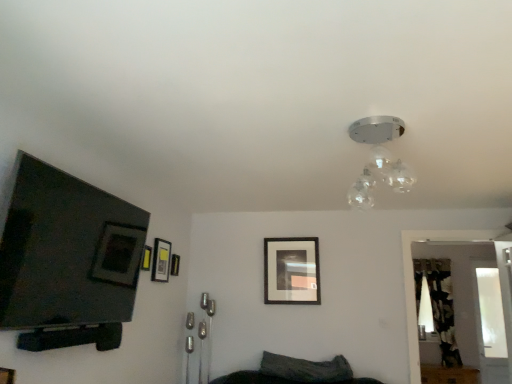
The height and width of the screenshot is (384, 512). What are the coordinates of `matte black picture frame at center, which is the 4th picture frame in left-to-right order` in the screenshot? It's located at coord(291,271).

How much space does matte black picture frame at upper left, which is the 4th picture frame in right-to-left order, occupy horizontally?

The width of matte black picture frame at upper left, which is the 4th picture frame in right-to-left order, is 1.37 inches.

Measure the distance between matte black picture frame at upper left, positioned as the 1th picture frame in front-to-back order, and camera.

They are 10.30 feet apart.

In order to face clear glass light fixture at upper center, should I rotate leftwards or rightwards?

You should look right and rotate roughly 16.570 degrees.

What are the coordinates of `matte black picture frame at upper left, which is counted as the third picture frame, starting from the back` in the screenshot? It's located at (161, 261).

In order to face matte black picture frame at upper left, arranged as the third picture frame when viewed from the front, should I rotate leftwards or rightwards?

Turn left approximately 10.620 degrees to face it.

From the picture: Measure the distance between point (x=174, y=265) and camera.

Point (x=174, y=265) and camera are 12.53 feet apart from each other.

You are a GUI agent. You are given a task and a screenshot of the screen. Output one action in this format:
    pyautogui.click(x=<x>, y=<y>)
    Task: Click on the matte black picture frame at center, which is the 4th picture frame in left-to-right order
    
    Given the screenshot: What is the action you would take?
    pyautogui.click(x=291, y=271)

Is matte black picture frame at center, the 1th picture frame viewed from the right, facing away from transparent glass door at right?

matte black picture frame at center, the 1th picture frame viewed from the right, is not turned away from transparent glass door at right.

How different are the orientations of matte black picture frame at center, the 1th picture frame viewed from the right, and transparent glass door at right in degrees?

The angle between the facing direction of matte black picture frame at center, the 1th picture frame viewed from the right, and the facing direction of transparent glass door at right is 2.74 degrees.

From a real-world perspective, who is located higher, matte black picture frame at center, the 1th picture frame viewed from the right, or transparent glass door at right?

matte black picture frame at center, the 1th picture frame viewed from the right, from a real-world perspective.

Is matte black picture frame at center, the 1th picture frame viewed from the right, taller than transparent glass door at right?

In fact, matte black picture frame at center, the 1th picture frame viewed from the right, may be shorter than transparent glass door at right.

Is clear glass light fixture at upper center positioned far away from transparent glass door at right?

Indeed, clear glass light fixture at upper center is not near transparent glass door at right.

Is clear glass light fixture at upper center wider or thinner than transparent glass door at right?

Considering their sizes, clear glass light fixture at upper center looks broader than transparent glass door at right.

From the image's perspective, is clear glass light fixture at upper center beneath transparent glass door at right?

Actually, clear glass light fixture at upper center appears above transparent glass door at right in the image.

Which object is positioned more to the right, clear glass light fixture at upper center or transparent glass door at right?

Positioned to the right is transparent glass door at right.

Which of these two, transparent glass door at right or dark gray fabric pillow at lower center, is smaller?

With smaller size is dark gray fabric pillow at lower center.

From the image's perspective, would you say transparent glass door at right is shown under dark gray fabric pillow at lower center?

Yes, from the image's perspective, transparent glass door at right is beneath dark gray fabric pillow at lower center.

From a real-world perspective, is transparent glass door at right over dark gray fabric pillow at lower center?

Indeed, from a real-world perspective, transparent glass door at right stands above dark gray fabric pillow at lower center.

Would you say transparent glass door at right is to the left or to the right of dark gray fabric pillow at lower center in the picture?

Based on their positions, transparent glass door at right is located to the right of dark gray fabric pillow at lower center.

Between matte black picture frame at upper left, placed as the third picture frame when sorted from left to right, and dark gray fabric pillow at lower center, which one is positioned behind?

matte black picture frame at upper left, placed as the third picture frame when sorted from left to right, is more distant.

Who is bigger, matte black picture frame at upper left, placed as the third picture frame when sorted from left to right, or dark gray fabric pillow at lower center?

dark gray fabric pillow at lower center.

Is matte black picture frame at upper left, the second picture frame when ordered from back to front, positioned beyond the bounds of dark gray fabric pillow at lower center?

Yes.

From a real-world perspective, between camouflage fabric curtain at right and clear glass light fixture at upper center, who is vertically lower?

camouflage fabric curtain at right is physically lower.

Considering the relative sizes of camouflage fabric curtain at right and clear glass light fixture at upper center in the image provided, is camouflage fabric curtain at right smaller than clear glass light fixture at upper center?

Incorrect, camouflage fabric curtain at right is not smaller in size than clear glass light fixture at upper center.

Is camouflage fabric curtain at right inside or outside of clear glass light fixture at upper center?

camouflage fabric curtain at right is spatially situated outside clear glass light fixture at upper center.

Considering the positions of objects camouflage fabric curtain at right and clear glass light fixture at upper center in the image provided, who is in front, camouflage fabric curtain at right or clear glass light fixture at upper center?

clear glass light fixture at upper center.

Is point (371, 172) positioned in front of point (170, 256)?

Yes, point (371, 172) is closer to viewer.

Does clear glass light fixture at upper center lie in front of matte black picture frame at upper left, the second picture frame when ordered from back to front?

Yes, clear glass light fixture at upper center is closer to the viewer.

Does clear glass light fixture at upper center have a greater width compared to matte black picture frame at upper left, placed as the third picture frame when sorted from left to right?

Yes, clear glass light fixture at upper center is wider than matte black picture frame at upper left, placed as the third picture frame when sorted from left to right.

From the image's perspective, does dark gray fabric pillow at lower center appear higher than transparent glass door at right?

Yes, from the image's perspective, dark gray fabric pillow at lower center is over transparent glass door at right.

From a real-world perspective, which object stands above the other?

From a 3D spatial view, transparent glass door at right is above.

How much distance is there between dark gray fabric pillow at lower center and transparent glass door at right?

dark gray fabric pillow at lower center and transparent glass door at right are 10.25 feet apart from each other.

Find the location of a particular element. window below the matte black picture frame at center, the 1th picture frame viewed from the right (from a real-world perspective) is located at coordinates tap(490, 313).

Locate an element on the screen. This screenshot has height=384, width=512. glass door behind the clear glass light fixture at upper center is located at coordinates (467, 295).

Considering their positions, is matte black picture frame at upper left, the second picture frame when ordered from back to front, positioned further to matte black picture frame at center, the first picture frame positioned from the back, than clear glass light fixture at upper center?

Based on the image, clear glass light fixture at upper center appears to be further to matte black picture frame at center, the first picture frame positioned from the back.

From the image, which object appears to be farther from matte black picture frame at upper left, which is the 4th picture frame in right-to-left order, clear glass light fixture at upper center or matte black picture frame at upper left, placed as the third picture frame when sorted from left to right?

clear glass light fixture at upper center is further to matte black picture frame at upper left, which is the 4th picture frame in right-to-left order.

Estimate the real-world distances between objects in this image. Which object is further from camouflage fabric curtain at right, matte black picture frame at center, the first picture frame positioned from the back, or matte black picture frame at upper left, the fourth picture frame in the back-to-front sequence?

The object further to camouflage fabric curtain at right is matte black picture frame at upper left, the fourth picture frame in the back-to-front sequence.

Looking at the image, which one is located closer to camouflage fabric curtain at right, matte black picture frame at upper left, which ranks as the second picture frame in front-to-back order, or transparent glass door at right?

transparent glass door at right is positioned closer to the anchor camouflage fabric curtain at right.

Which object lies further to the anchor point transparent glass door at right, camouflage fabric curtain at right or matte black picture frame at upper left, positioned as the 1th picture frame in front-to-back order?

matte black picture frame at upper left, positioned as the 1th picture frame in front-to-back order.

Which object lies further to the anchor point matte black picture frame at upper left, which ranks as the second picture frame in front-to-back order, transparent glass door at right or matte black picture frame at upper left, which is the 4th picture frame in right-to-left order?

The object further to matte black picture frame at upper left, which ranks as the second picture frame in front-to-back order, is transparent glass door at right.

From the image, which object appears to be nearer to matte black picture frame at upper left, the 2th picture frame from the right, transparent glass door at right or matte black picture frame at center, the 1th picture frame viewed from the right?

The object closer to matte black picture frame at upper left, the 2th picture frame from the right, is matte black picture frame at center, the 1th picture frame viewed from the right.

Considering their positions, is dark gray fabric pillow at lower center positioned closer to clear glass light fixture at upper center than matte black picture frame at upper left, which is counted as the third picture frame, starting from the back?

matte black picture frame at upper left, which is counted as the third picture frame, starting from the back, lies closer to clear glass light fixture at upper center than the other object.

The image size is (512, 384). What are the coordinates of `glass door between matte black picture frame at upper left, the 2th picture frame from the right, and transparent glass door at right` in the screenshot? It's located at (467, 295).

Where is `pillow located between matte black picture frame at upper left, arranged as the third picture frame when viewed from the front, and camouflage fabric curtain at right in the left-right direction`? pillow located between matte black picture frame at upper left, arranged as the third picture frame when viewed from the front, and camouflage fabric curtain at right in the left-right direction is located at coordinates (306, 369).

You are a GUI agent. You are given a task and a screenshot of the screen. Output one action in this format:
    pyautogui.click(x=<x>, y=<y>)
    Task: Click on the pillow between clear glass light fixture at upper center and matte black picture frame at center, which is the 4th picture frame in left-to-right order, along the z-axis
    This screenshot has width=512, height=384.
    Given the screenshot: What is the action you would take?
    pyautogui.click(x=306, y=369)

This screenshot has height=384, width=512. What are the coordinates of `pillow between matte black picture frame at upper left, which is the 4th picture frame in right-to-left order, and transparent glass door at right, in the horizontal direction` in the screenshot? It's located at (306, 369).